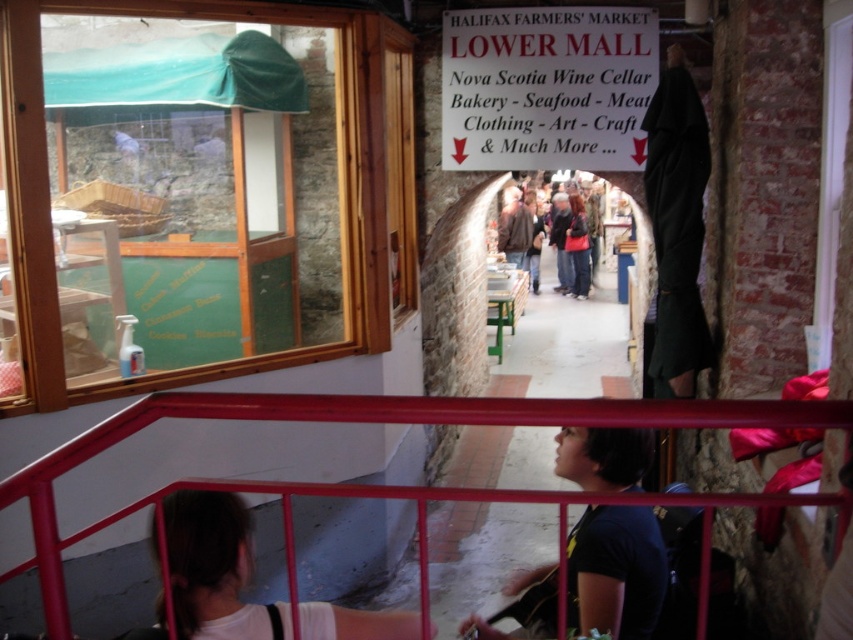
You are standing on the balcony overlooking the Halifax Farmers Market and see two people below. One is wearing a matte black jacket at center and dark blue jeans at center. Which clothing item is taller from your viewpoint?

The matte black jacket at center is taller than the dark blue jeans at center from your viewpoint.

You are standing on the balcony overlooking the Halifax Farmers Market and notice two people below. One is wearing a white matte shirt at lower left and the other a matte black jacket at center. Which person takes up more space in the photo?

The matte black jacket at center occupies more space in the photo than the white matte shirt at lower left.

You are standing on the balcony at the Halifax Farmers Market and see the metallic red railing at lower center and the dark blue jeans at center. Which object is shorter?

The metallic red railing at lower center is not as tall as the dark blue jeans at center, so the railing is shorter.